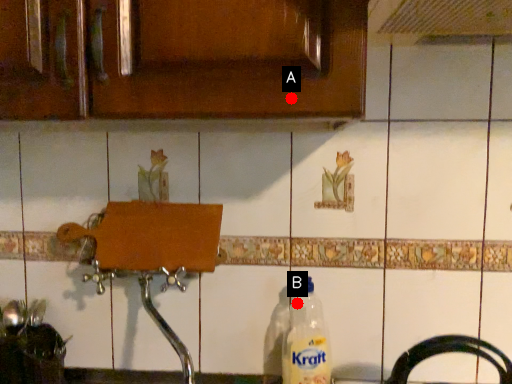
Question: Two points are circled on the image, labeled by A and B beside each circle. Which point appears farthest from the camera in this image?

Choices:
 (A) A is further
 (B) B is further

Answer: (B)